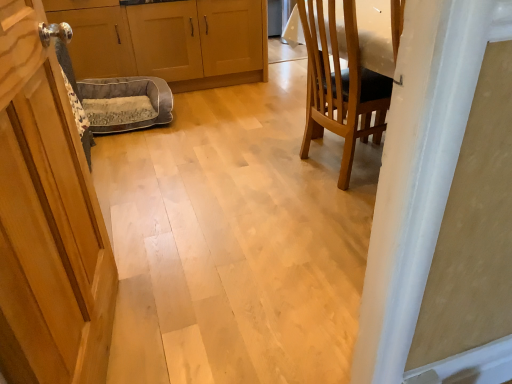
Locate an element on the screen. free space to the left of wooden chair at right is located at coordinates 254,171.